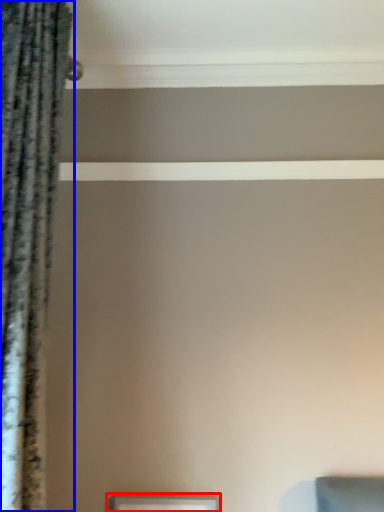
Question: Which point is closer to the camera, picture frame (highlighted by a red box) or curtain (highlighted by a blue box)?

Choices:
 (A) picture frame
 (B) curtain

Answer: (B)